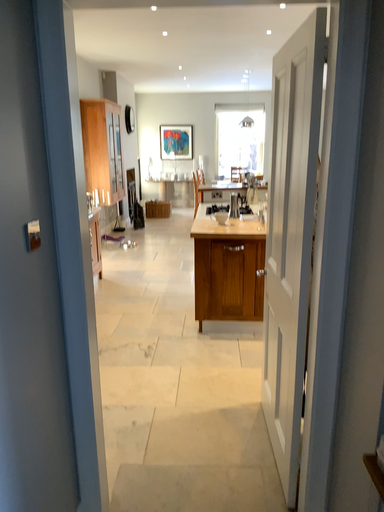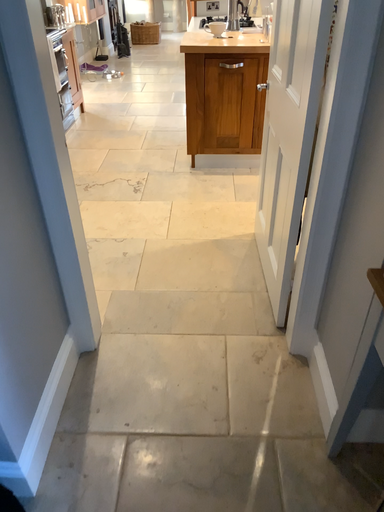
Question: Which way did the camera rotate in the video?

Choices:
 (A) rotated upward
 (B) rotated downward

Answer: (B)